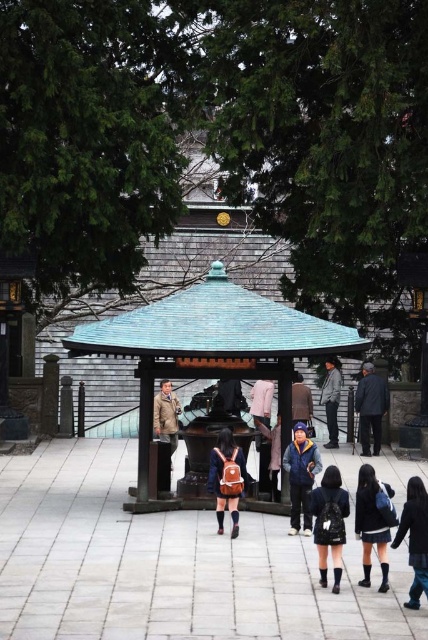
You are standing in front of the pavilion at the traditional Japanese temple. You notice two points marked in the scene. The first point is at coordinates point (229, 429) and the second is at point (383, 401). Which of these two points is closer to your current position?

Point (229, 429) is closer to the camera than point (383, 401), so the first point is closer to your current position.